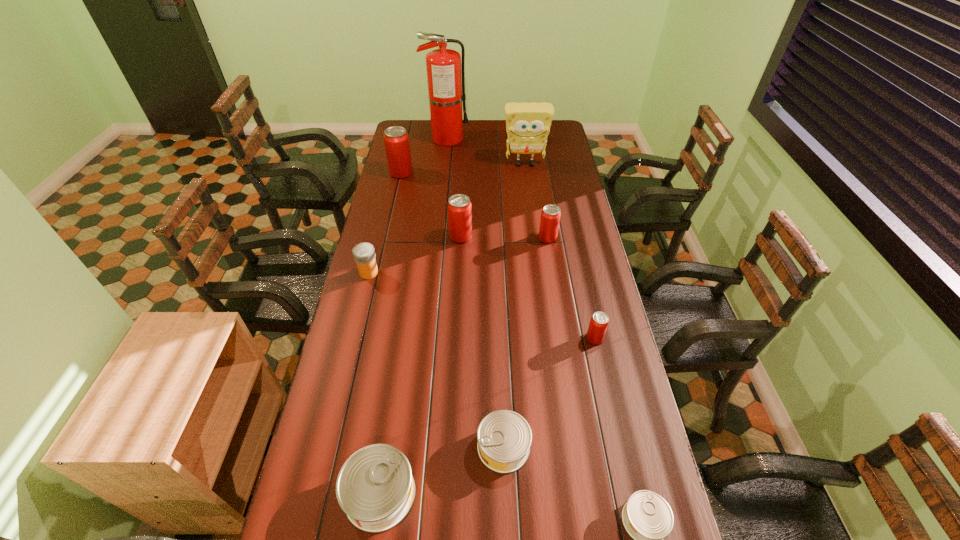
Locate an element on the screen. orange medicine is located at coordinates (364, 254).

Where is `the fourth nearest object`? The width and height of the screenshot is (960, 540). the fourth nearest object is located at coordinates (599, 321).

Image resolution: width=960 pixels, height=540 pixels. Identify the location of the fourth nearest can. (599, 321).

Locate an element on the screen. This screenshot has height=540, width=960. the biggest silver can is located at coordinates (375, 487).

What are the coordinates of `the ninth tallest object` in the screenshot? It's located at (504, 437).

Find the location of `the second shortest can`. the second shortest can is located at coordinates (504, 437).

You are a GUI agent. You are given a task and a screenshot of the screen. Output one action in this format:
    pyautogui.click(x=<x>, y=<y>)
    Task: Click on the vacant area situated at the nozzle of the fire extinguisher
    The width and height of the screenshot is (960, 540).
    Given the screenshot: What is the action you would take?
    pyautogui.click(x=492, y=139)

You are a GUI agent. You are given a task and a screenshot of the screen. Output one action in this format:
    pyautogui.click(x=<x>, y=<y>)
    Task: Click on the free location located on the face of the sponge
    Image resolution: width=960 pixels, height=540 pixels.
    Given the screenshot: What is the action you would take?
    (x=529, y=191)

Where is `free space located on the right of the farthest can`? This screenshot has width=960, height=540. free space located on the right of the farthest can is located at coordinates (465, 173).

Identify the location of free space located on the front of the second tallest can. (457, 309).